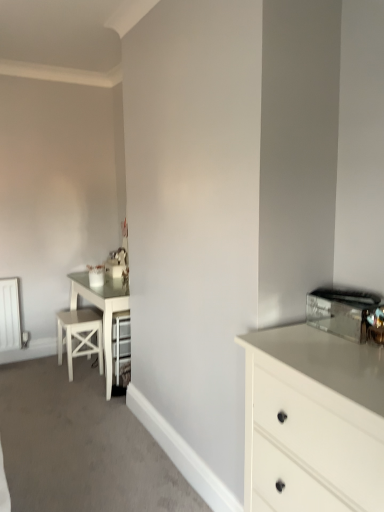
Measure the distance between white glossy chest of drawers at right and camera.

A distance of 37.66 inches exists between white glossy chest of drawers at right and camera.

What is the approximate height of white glossy chest of drawers at right?

34.97 inches.

Identify the location of white wood bar stool at left. This screenshot has width=384, height=512. (79, 336).

What is the approximate width of shiny metallic toaster at upper right?

The width of shiny metallic toaster at upper right is 8.38 inches.

At what (x,y) coordinates should I click in order to perform the action: click on white glossy chest of drawers at right. Please return your answer as a coordinate pair (x, y). Looking at the image, I should click on (312, 422).

Considering the relative positions of white wood bar stool at left and shiny metallic toaster at upper right in the image provided, is white wood bar stool at left in front of shiny metallic toaster at upper right?

No, white wood bar stool at left is further to the viewer.

In the scene shown: From a real-world perspective, is white wood bar stool at left beneath shiny metallic toaster at upper right?

Indeed, from a real-world perspective, white wood bar stool at left is positioned beneath shiny metallic toaster at upper right.

Locate an element on the screen. bar stool that is on the left side of shiny metallic toaster at upper right is located at coordinates (79, 336).

Is shiny metallic toaster at upper right positioned beyond the bounds of white wood bar stool at left?

Yes, shiny metallic toaster at upper right is not within white wood bar stool at left.

Looking at this image, who is bigger, shiny metallic toaster at upper right or white wood bar stool at left?

Bigger between the two is white wood bar stool at left.

How distant is shiny metallic toaster at upper right from white glossy chest of drawers at right?

A distance of 12.49 inches exists between shiny metallic toaster at upper right and white glossy chest of drawers at right.

Is white glossy chest of drawers at right located within shiny metallic toaster at upper right?

No.

Does point (356, 296) lie in front of point (383, 443)?

That is False.

From a real-world perspective, is shiny metallic toaster at upper right physically located above or below white glossy chest of drawers at right?

shiny metallic toaster at upper right is situated higher than white glossy chest of drawers at right in the real world.

Measure the distance between white glossy chest of drawers at right and white wood bar stool at left.

A distance of 2.01 meters exists between white glossy chest of drawers at right and white wood bar stool at left.

From a real-world perspective, who is located higher, white glossy chest of drawers at right or white wood bar stool at left?

white glossy chest of drawers at right.

Would you say white glossy chest of drawers at right is outside white wood bar stool at left?

Yes.

Is white glossy chest of drawers at right not near white wood bar stool at left?

Yes, white glossy chest of drawers at right is far from white wood bar stool at left.

From the image's perspective, is white glossy chest of drawers at right located above or below shiny metallic toaster at upper right?

From the image's perspective, white glossy chest of drawers at right appears below shiny metallic toaster at upper right.

Considering the sizes of objects white glossy chest of drawers at right and shiny metallic toaster at upper right in the image provided, who is shorter, white glossy chest of drawers at right or shiny metallic toaster at upper right?

shiny metallic toaster at upper right.

Could you measure the distance between white glossy chest of drawers at right and shiny metallic toaster at upper right?

white glossy chest of drawers at right is 12.49 inches away from shiny metallic toaster at upper right.

How many degrees apart are the facing directions of white glossy chest of drawers at right and shiny metallic toaster at upper right?

0.477 degrees.

From the image's perspective, does white wood bar stool at left appear lower than white glossy chest of drawers at right?

No.

From a real-world perspective, does white wood bar stool at left sit lower than white glossy chest of drawers at right?

Yes, from a real-world perspective, white wood bar stool at left is beneath white glossy chest of drawers at right.

Is white wood bar stool at left positioned before white glossy chest of drawers at right?

That is False.

In the image, there is a white wood bar stool at left. Identify the location of appliance above it (from the image's perspective). This screenshot has width=384, height=512. (344, 312).

Identify the location of bar stool lying behind the shiny metallic toaster at upper right. This screenshot has height=512, width=384. (79, 336).

Based on their spatial positions, is white glossy chest of drawers at right or shiny metallic toaster at upper right closer to white wood bar stool at left?

white glossy chest of drawers at right lies closer to white wood bar stool at left than the other object.

Looking at the image, which one is located further to white glossy chest of drawers at right, white wood bar stool at left or shiny metallic toaster at upper right?

white wood bar stool at left is further to white glossy chest of drawers at right.

Considering their positions, is shiny metallic toaster at upper right positioned closer to white wood bar stool at left than white glossy chest of drawers at right?

white glossy chest of drawers at right lies closer to white wood bar stool at left than the other object.

From the image, which object appears to be nearer to white glossy chest of drawers at right, shiny metallic toaster at upper right or white wood bar stool at left?

shiny metallic toaster at upper right.

Which object lies further to the anchor point shiny metallic toaster at upper right, white glossy chest of drawers at right or white wood bar stool at left?

white wood bar stool at left is further to shiny metallic toaster at upper right.

When comparing their distances from shiny metallic toaster at upper right, does white wood bar stool at left or white glossy chest of drawers at right seem closer?

The object closer to shiny metallic toaster at upper right is white glossy chest of drawers at right.

The height and width of the screenshot is (512, 384). What are the coordinates of `appliance between white glossy chest of drawers at right and white wood bar stool at left in the front-back direction` in the screenshot? It's located at (344, 312).